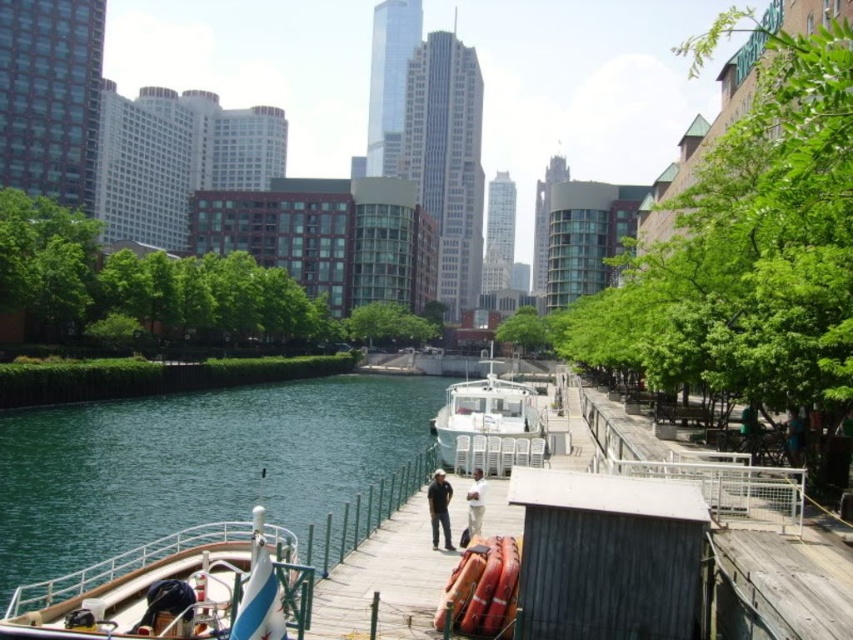
How much distance is there between green water at center and white plastic boat at center?

green water at center is 16.72 meters from white plastic boat at center.

Identify the location of green water at center. The width and height of the screenshot is (853, 640). (195, 461).

Between green water at center and light beige fabric at center, which one is positioned higher?

light beige fabric at center

Is point (299, 516) positioned after point (480, 476)?

Yes, point (299, 516) is behind point (480, 476).

Locate an element on the screen. green water at center is located at coordinates (195, 461).

Can you confirm if white plastic boat at center is positioned below light beige fabric at center?

Incorrect, white plastic boat at center is not positioned below light beige fabric at center.

Is white plastic boat at center wider than light beige fabric at center?

Yes, white plastic boat at center is wider than light beige fabric at center.

Does point (453, 406) come in front of point (479, 490)?

No, it is behind (479, 490).

Identify the location of white plastic boat at center. This screenshot has width=853, height=640. 485,412.